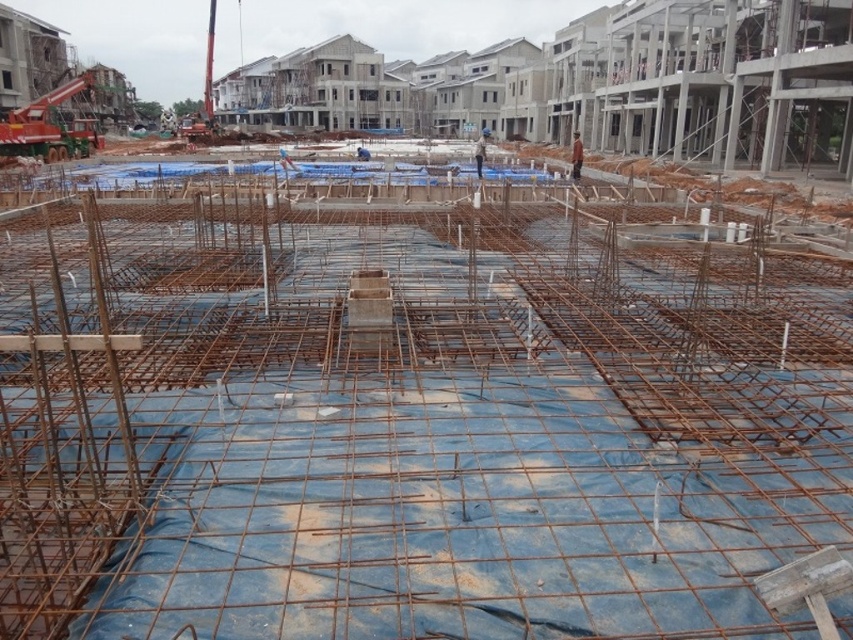
This screenshot has height=640, width=853. I want to click on brown leather jacket at center, so pyautogui.click(x=576, y=156).

Can you confirm if brown leather jacket at center is shorter than blue hard hat at center?

Indeed, brown leather jacket at center has a lesser height compared to blue hard hat at center.

Between point (581, 154) and point (486, 140), which one is positioned in front?

Point (581, 154) is in front.

Identify the location of brown leather jacket at center. (576, 156).